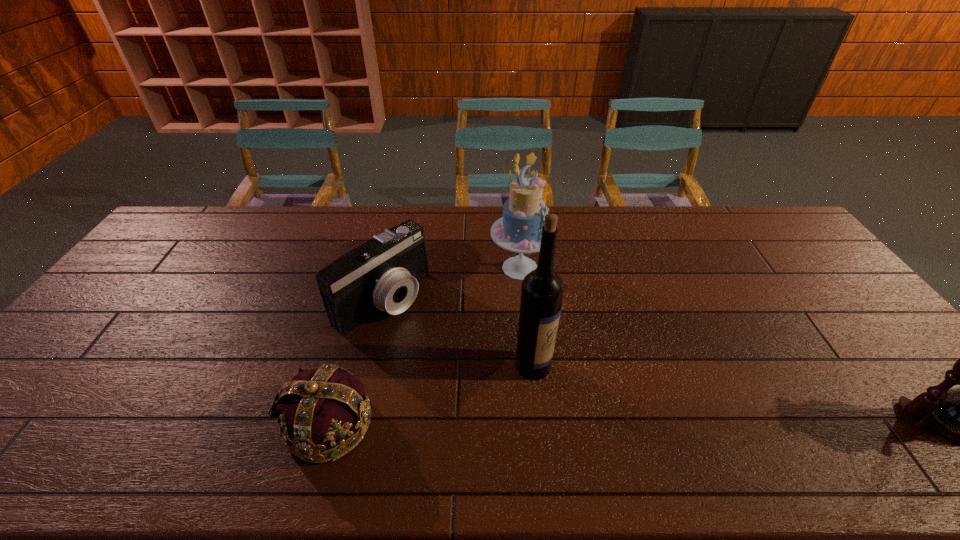
This screenshot has height=540, width=960. What are the coordinates of `vacant area located on the lens of the fourth tallest object` in the screenshot? It's located at (481, 373).

Where is `vacant space located 0.100m with a ladder on the side of the second tallest object`? The height and width of the screenshot is (540, 960). vacant space located 0.100m with a ladder on the side of the second tallest object is located at coordinates (558, 306).

Locate an element on the screen. free location located with a ladder on the side of the second tallest object is located at coordinates (554, 301).

I want to click on vacant space located 0.080m with a ladder on the side of the second tallest object, so click(554, 301).

Locate an element on the screen. The height and width of the screenshot is (540, 960). object positioned at the near edge is located at coordinates (325, 412).

Locate an element on the screen. vacant space at the far edge of the desktop is located at coordinates (430, 240).

Where is `vacant space at the left edge of the desktop`? The height and width of the screenshot is (540, 960). vacant space at the left edge of the desktop is located at coordinates (82, 329).

Image resolution: width=960 pixels, height=540 pixels. In the image, there is a desktop. Identify the location of free space at the far left corner. (189, 217).

The width and height of the screenshot is (960, 540). In the image, there is a desktop. Find the location of `vacant space at the far right corner`. vacant space at the far right corner is located at coordinates (734, 210).

Find the location of `free space between the crown and the camcorder`. free space between the crown and the camcorder is located at coordinates (355, 361).